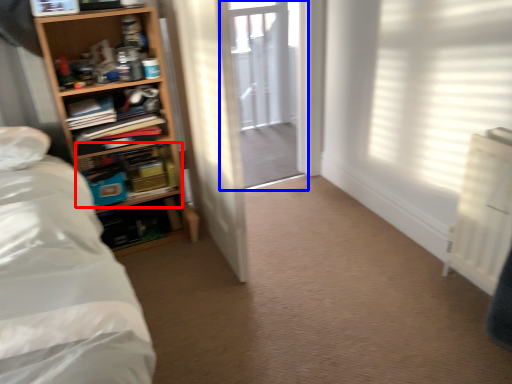
Question: Which of the following is the closest to the observer, shelf (highlighted by a red box) or screen door (highlighted by a blue box)?

Choices:
 (A) shelf
 (B) screen door

Answer: (A)